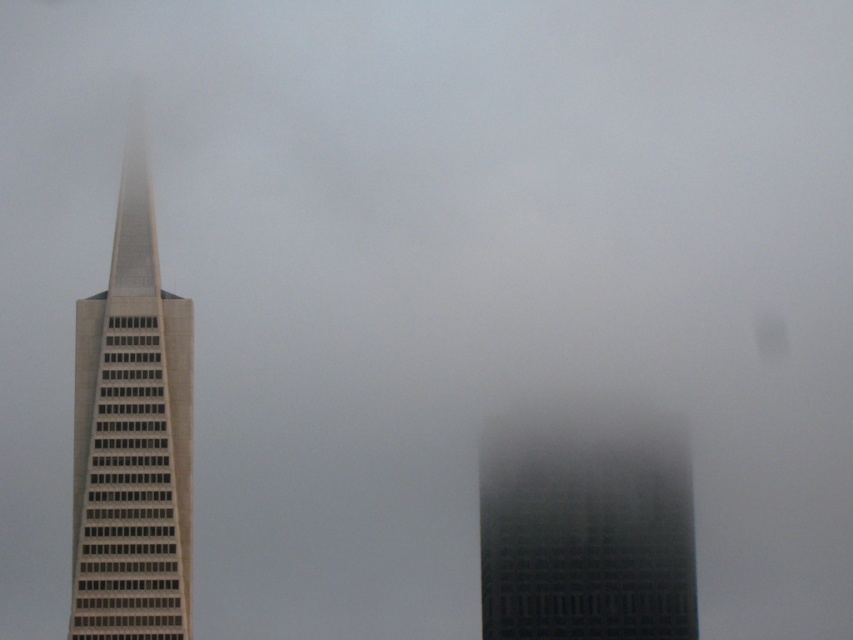
You are standing in the foggy urban scene with two skyscrapers. You see two points marked in the image. The first point is at coordinates point (119, 634) and the second is at point (538, 524). Which point is nearer to you?

Point (119, 634) is closer to the viewer than point (538, 524).

From the picture: You are a drone operator tasked with capturing aerial footage of the beige glass skyscraper at left. The drone must maintain a safe distance of at least 100 meters from the building to avoid collisions. Given the coordinates provided in the description, can you confirm if the drone is positioned safely?

The beige glass skyscraper at left is located at point coordinates, but without specific drone position data, I cannot confirm the safety distance. Please provide the drone coordinates for accurate assessment.

You are a drone operator tasked with flying a drone between the beige glass skyscraper at left and the dark gray glass building at center. The drone has a maximum flight distance of 150 meters. Can the drone safely complete the flight between these two buildings?

The distance between the beige glass skyscraper at left and the dark gray glass building at center is 148.97 meters, which is within the drone operator maximum flight distance of 150 meters. The drone can safely complete the flight between these two buildings.